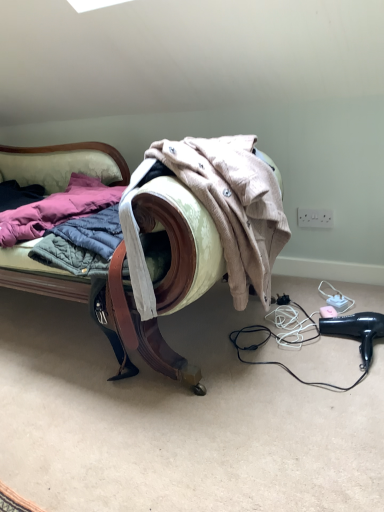
I want to click on black plastic hair dryer at lower right, so click(356, 331).

This screenshot has height=512, width=384. Describe the element at coordinates (356, 331) in the screenshot. I see `black plastic hair dryer at lower right` at that location.

What is the approximate height of black plastic hair dryer at lower right?

4.40 inches.

The height and width of the screenshot is (512, 384). Describe the element at coordinates (154, 286) in the screenshot. I see `wooden armchair at center` at that location.

At what (x,y) coordinates should I click in order to perform the action: click on wooden armchair at center. Please return your answer as a coordinate pair (x, y). Looking at the image, I should click on coord(154,286).

Where is `black plastic hair dryer at lower right`? black plastic hair dryer at lower right is located at coordinates (356, 331).

Considering the relative positions of wooden armchair at center and black plastic hair dryer at lower right in the image provided, is wooden armchair at center to the left or to the right of black plastic hair dryer at lower right?

wooden armchair at center is to the left of black plastic hair dryer at lower right.

Considering the positions of objects wooden armchair at center and black plastic hair dryer at lower right in the image provided, who is behind, wooden armchair at center or black plastic hair dryer at lower right?

black plastic hair dryer at lower right.

Which is in front, point (183, 271) or point (359, 348)?

Point (183, 271)

Looking at this image, from the image's perspective, is wooden armchair at center positioned above or below black plastic hair dryer at lower right?

wooden armchair at center is situated higher than black plastic hair dryer at lower right in the image.

From a real-world perspective, who is located higher, wooden armchair at center or black plastic hair dryer at lower right?

wooden armchair at center, from a real-world perspective.

Considering the sizes of wooden armchair at center and black plastic hair dryer at lower right in the image, is wooden armchair at center wider or thinner than black plastic hair dryer at lower right?

wooden armchair at center is wider than black plastic hair dryer at lower right.

Considering the sizes of wooden armchair at center and black plastic hair dryer at lower right in the image, is wooden armchair at center taller or shorter than black plastic hair dryer at lower right?

Considering their sizes, wooden armchair at center has more height than black plastic hair dryer at lower right.

Considering the sizes of objects wooden armchair at center and black plastic hair dryer at lower right in the image provided, who is smaller, wooden armchair at center or black plastic hair dryer at lower right?

Smaller between the two is black plastic hair dryer at lower right.

Is wooden armchair at center spatially inside black plastic hair dryer at lower right, or outside of it?

wooden armchair at center is located beyond the bounds of black plastic hair dryer at lower right.

Is wooden armchair at center not near black plastic hair dryer at lower right?

No, wooden armchair at center is in close proximity to black plastic hair dryer at lower right.

Is wooden armchair at center facing away from black plastic hair dryer at lower right?

No, wooden armchair at center is not facing the opposite direction of black plastic hair dryer at lower right.

Can you tell me how much wooden armchair at center and black plastic hair dryer at lower right differ in facing direction?

9.9 degrees separate the facing orientations of wooden armchair at center and black plastic hair dryer at lower right.

Image resolution: width=384 pixels, height=512 pixels. Find the location of `hair drier below the wooden armchair at center (from the image's perspective)`. hair drier below the wooden armchair at center (from the image's perspective) is located at coordinates (356, 331).

Would you say black plastic hair dryer at lower right is to the left or to the right of wooden armchair at center in the picture?

From the image, it's evident that black plastic hair dryer at lower right is to the right of wooden armchair at center.

Is black plastic hair dryer at lower right closer to the viewer compared to wooden armchair at center?

No, it is not.

Is point (327, 318) positioned after point (182, 307)?

No, (327, 318) is in front of (182, 307).

From the image's perspective, which is below, black plastic hair dryer at lower right or wooden armchair at center?

black plastic hair dryer at lower right, from the image's perspective.

From a real-world perspective, is black plastic hair dryer at lower right positioned over wooden armchair at center based on gravity?

No, from a real-world perspective, black plastic hair dryer at lower right is not over wooden armchair at center

Which of these two, black plastic hair dryer at lower right or wooden armchair at center, is thinner?

black plastic hair dryer at lower right.

Who is shorter, black plastic hair dryer at lower right or wooden armchair at center?

Standing shorter between the two is black plastic hair dryer at lower right.

Can you confirm if black plastic hair dryer at lower right is bigger than wooden armchair at center?

No, black plastic hair dryer at lower right is not bigger than wooden armchair at center.

Is black plastic hair dryer at lower right spatially inside wooden armchair at center, or outside of it?

black plastic hair dryer at lower right is not enclosed by wooden armchair at center.

Is there a large distance between black plastic hair dryer at lower right and wooden armchair at center?

black plastic hair dryer at lower right is actually quite close to wooden armchair at center.

Could you tell me if black plastic hair dryer at lower right is turned towards wooden armchair at center?

No, black plastic hair dryer at lower right is not turned towards wooden armchair at center.

Identify the location of hair drier on the right of the wooden armchair at center. Image resolution: width=384 pixels, height=512 pixels. (356, 331).

You are a GUI agent. You are given a task and a screenshot of the screen. Output one action in this format:
    pyautogui.click(x=<x>, y=<y>)
    Task: Click on the furniture on the left of the black plastic hair dryer at lower right
    The image size is (384, 512).
    Given the screenshot: What is the action you would take?
    pyautogui.click(x=154, y=286)

The height and width of the screenshot is (512, 384). What are the coordinates of `furniture located above the black plastic hair dryer at lower right (from a real-world perspective)` in the screenshot? It's located at (154, 286).